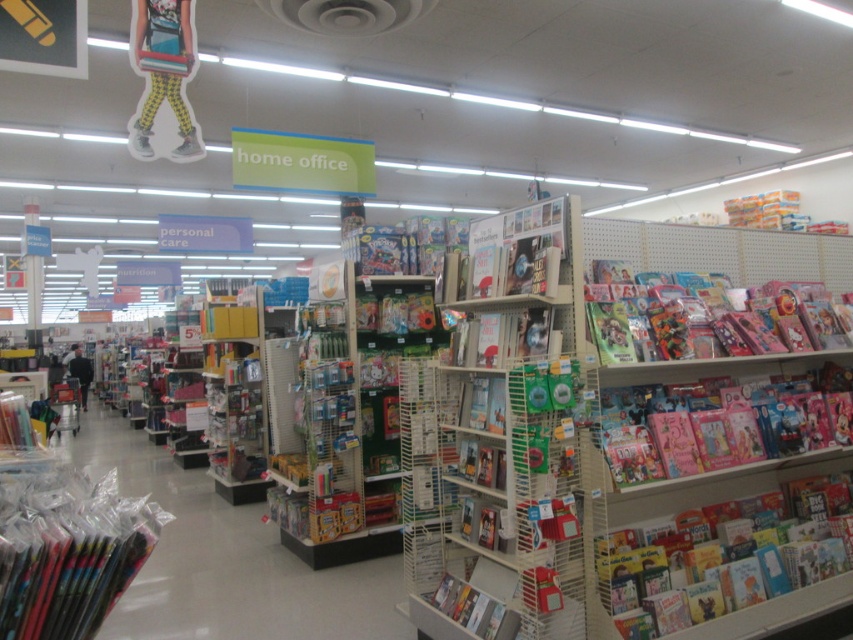
Consider the image. You are a customer looking to grab a book quickly. You see the white cardboard books at center and the pink glossy book at right. Which one can you reach without moving further forward?

The white cardboard books at center are closer to the viewer than the pink glossy book at right, so you can reach them without moving further forward.

You are standing in the retail store looking at the home office and children book section. There are two points marked on the shelves in front of you. The first point is at coordinate point (514,444) and the second point is at coordinate point (633,426). Which point is closer to you?

Point (514,444) is closer to the viewer than point (633,426).